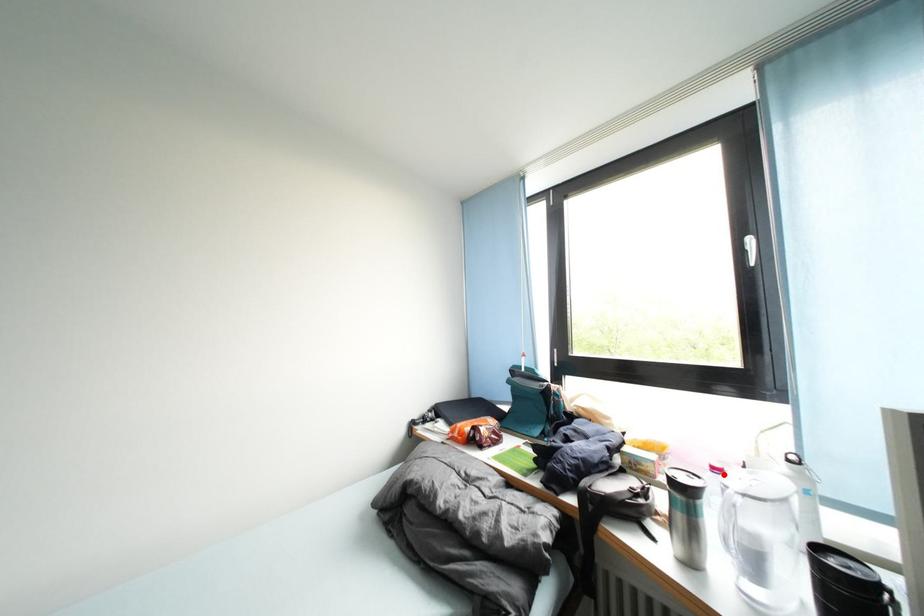
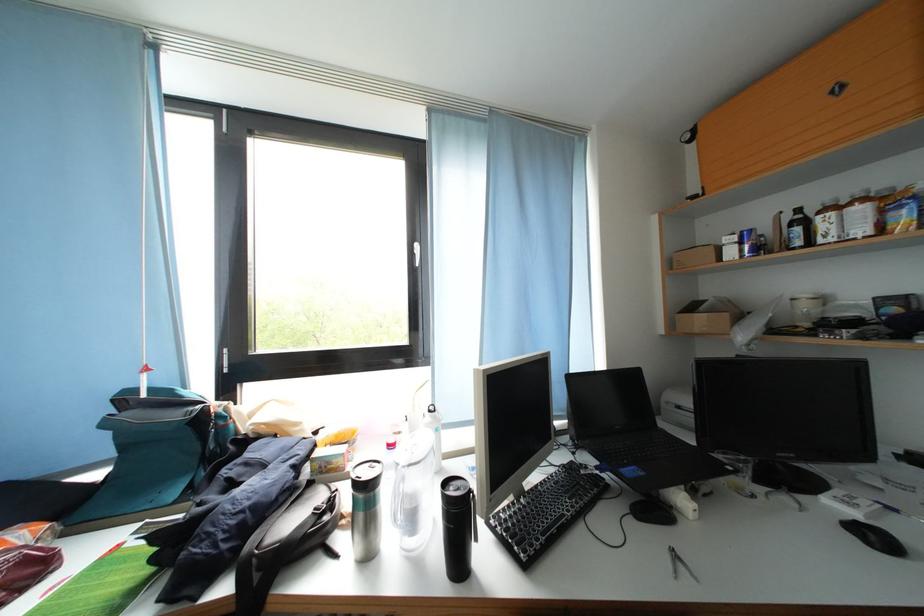
Where in the second image is the point corresponding to the highlighted location from the first image?

(398, 451)